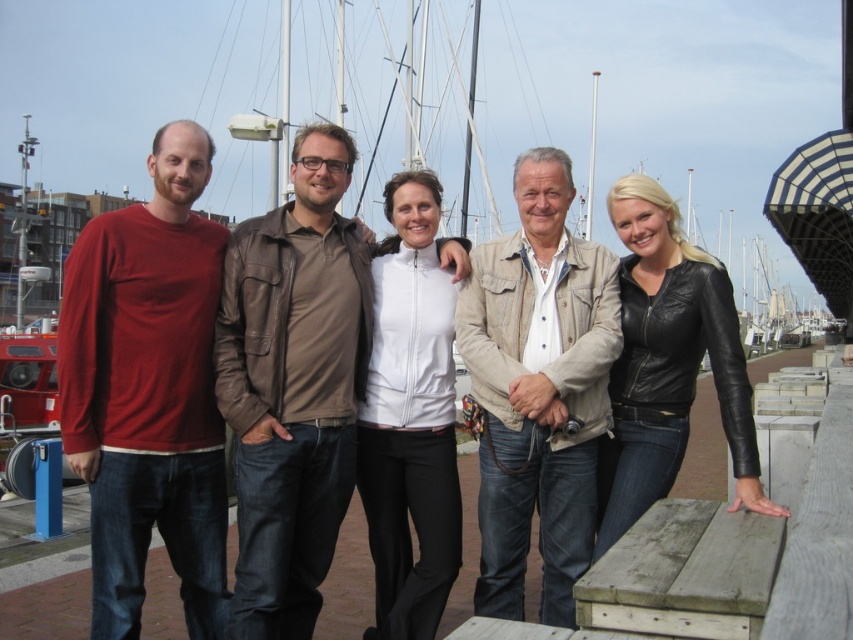
Can you confirm if matte black jacket at left is positioned to the left of beige textured jacket at center?

Yes, matte black jacket at left is to the left of beige textured jacket at center.

Is point (306, 196) in front of point (563, 321)?

No, (306, 196) is further to viewer.

The image size is (853, 640). I want to click on matte black jacket at left, so pyautogui.click(x=294, y=388).

Is matte black jacket at left thinner than black leather jacket at right?

Incorrect, matte black jacket at left's width is not less than black leather jacket at right's.

Measure the distance between matte black jacket at left and camera.

The distance of matte black jacket at left from camera is 9.74 meters.

This screenshot has width=853, height=640. Identify the location of matte black jacket at left. (294, 388).

Locate an element on the screen. matte black jacket at left is located at coordinates (294, 388).

Can you confirm if white matte jacket at center is wider than black leather jacket at right?

No, white matte jacket at center is not wider than black leather jacket at right.

Is point (409, 230) more distant than point (663, 445)?

Yes, it is behind point (663, 445).

Where is `white matte jacket at center`? The height and width of the screenshot is (640, 853). white matte jacket at center is located at coordinates (410, 413).